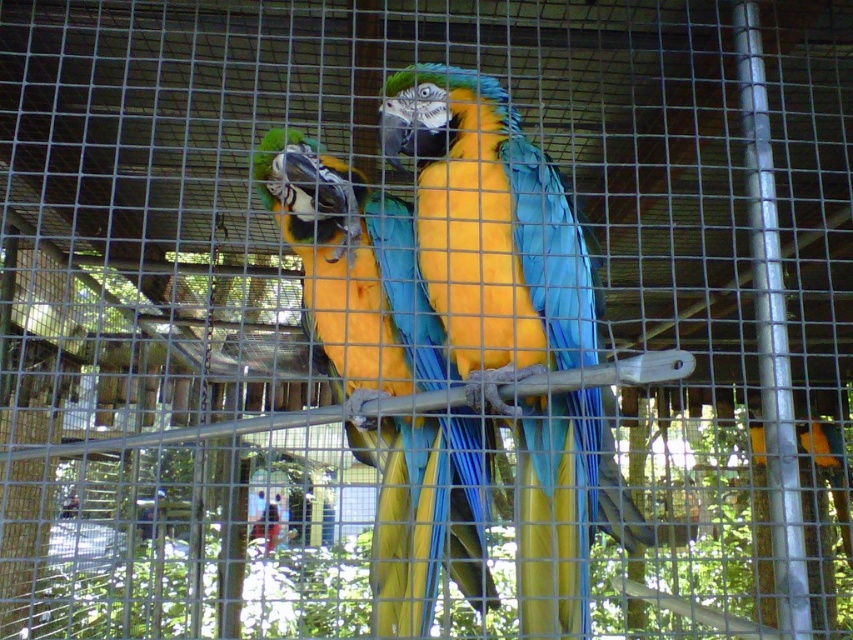
Who is more forward, (583, 611) or (346, 237)?

Point (583, 611)

Is blue glossy parrot at center behind shiny blue parrot at center?

Yes, blue glossy parrot at center is further from the viewer.

Measure the distance between point (585,518) and camera.

The distance of point (585,518) from camera is 1.65 meters.

The image size is (853, 640). I want to click on blue glossy parrot at center, so click(512, 317).